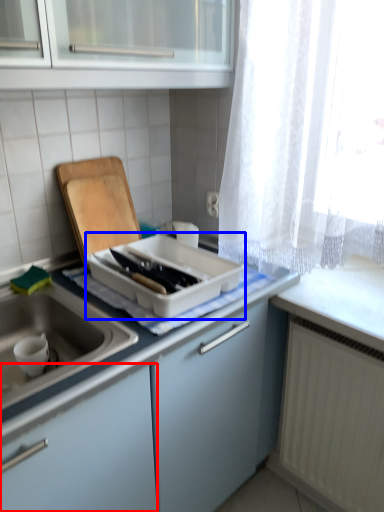
Question: Which object is closer to the camera taking this photo, cabinetry (highlighted by a red box) or kitchen appliance (highlighted by a blue box)?

Choices:
 (A) cabinetry
 (B) kitchen appliance

Answer: (A)